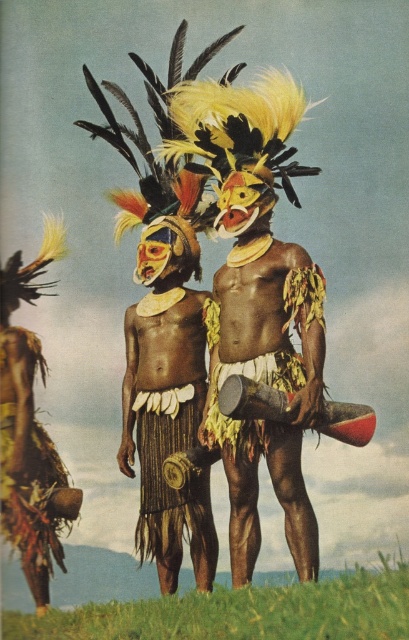
You are a photographer trying to capture the cultural attire of the two men in the scene. You need to ensure that both the matte brown skin at center and the brown woven skirt at center are clearly visible in the frame. Given the distance between them, will you need to adjust your camera settings to focus on both elements simultaneously?

The distance between the matte brown skin at center and the brown woven skirt at center is 6.92 feet. Since the two elements are separated by this distance, you will need to adjust your camera settings to ensure both are in focus, possibly using a smaller aperture for a greater depth of field.